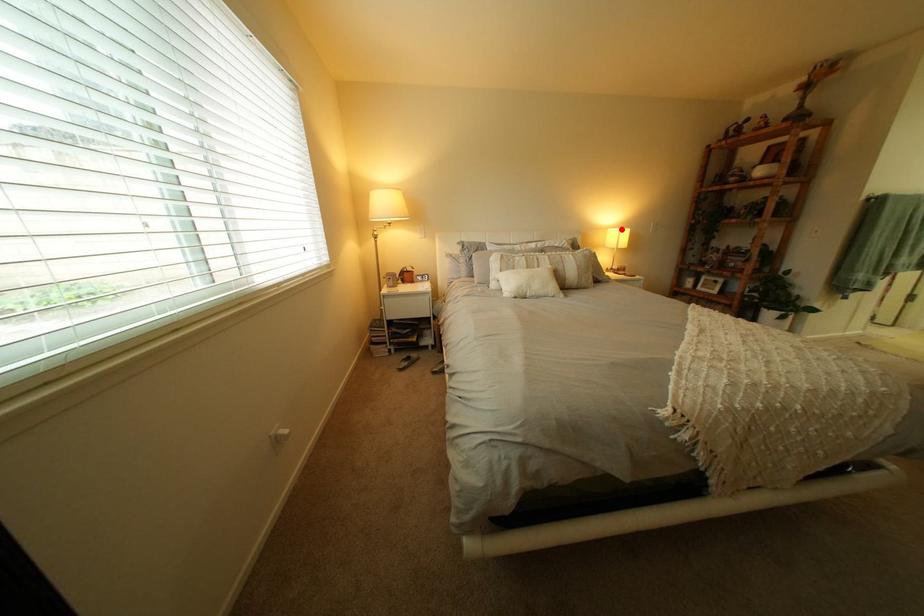
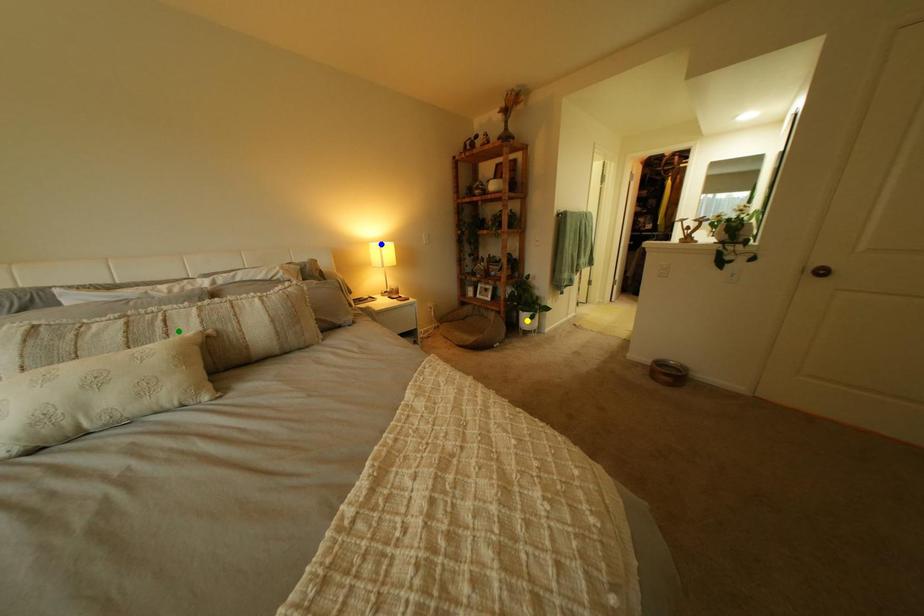
Question: I am providing you with two images of the same scene from different viewpoints. A red point is marked on the first image. You are given multiple points on the second image. Which mark in image 2 goes with the point in image 1?

Choices:
 (A) yellow point
 (B) blue point
 (C) green point

Answer: (B)